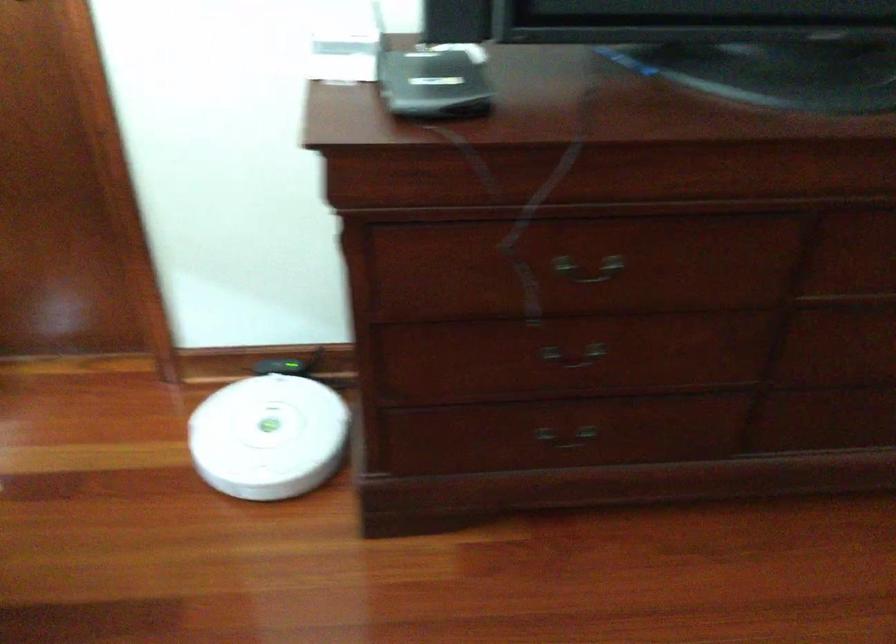
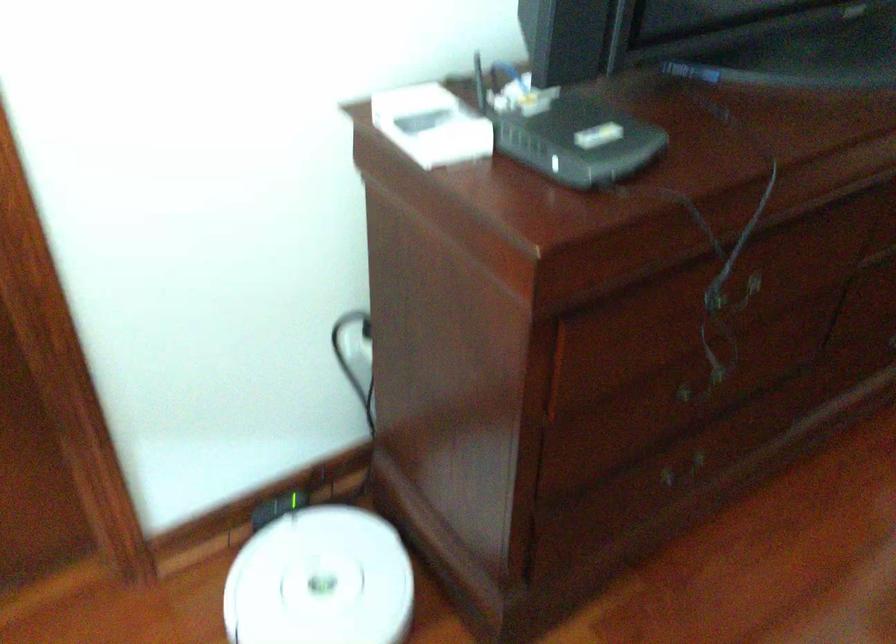
The point at (444, 75) is marked in the first image. Where is the corresponding point in the second image?

(569, 134)